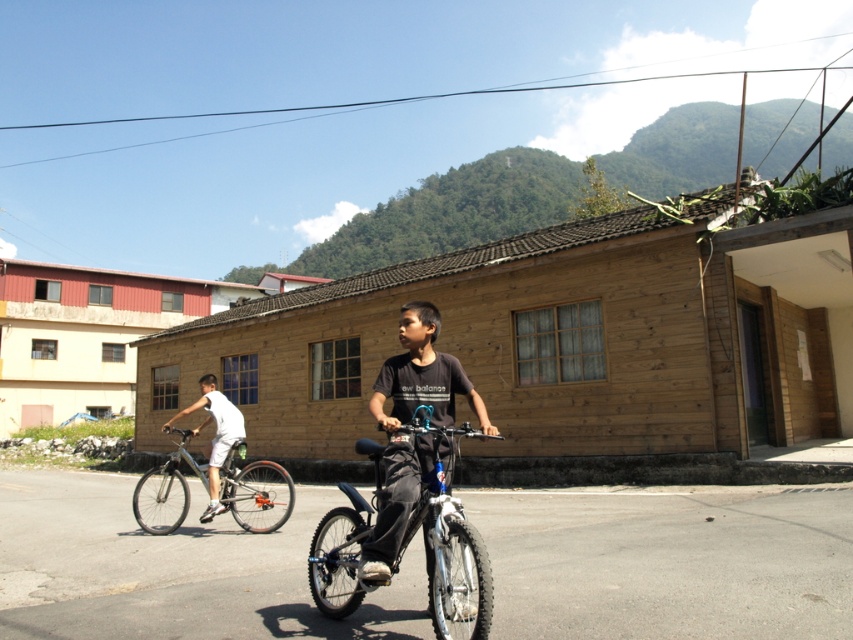
Question: Is dark gray cotton shirt at center bigger than silver metallic bicycle at left?

Choices:
 (A) yes
 (B) no

Answer: (B)

Question: Does shiny blue bicycle at center lie behind silver metallic bicycle at left?

Choices:
 (A) no
 (B) yes

Answer: (A)

Question: Among these objects, which one is nearest to the camera?

Choices:
 (A) silver metallic bicycle at left
 (B) dark gray cotton shirt at center
 (C) shiny blue bicycle at center
 (D) white matte bicycle at left

Answer: (C)

Question: Which of these objects is positioned farthest from the white matte bicycle at left?

Choices:
 (A) silver metallic bicycle at left
 (B) dark gray cotton shirt at center
 (C) shiny blue bicycle at center

Answer: (C)

Question: Which object is positioned closest to the silver metallic bicycle at left?

Choices:
 (A) white matte bicycle at left
 (B) shiny blue bicycle at center
 (C) dark gray cotton shirt at center

Answer: (A)

Question: Does shiny blue bicycle at center appear on the right side of silver metallic bicycle at left?

Choices:
 (A) yes
 (B) no

Answer: (A)